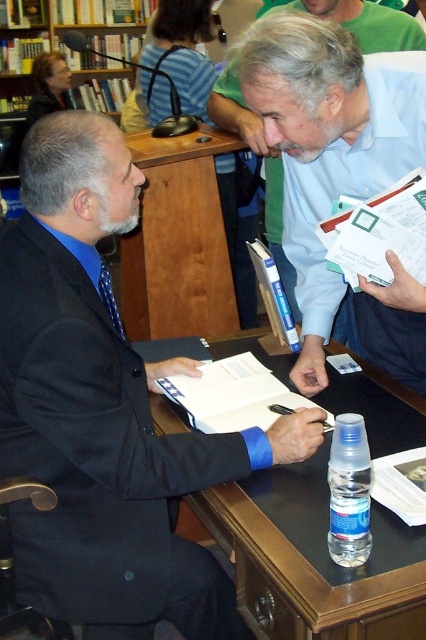
You are a delivery person who needs to place a small package on the desk without disturbing the black matte suit at center or the white paper at center. The package is 10 inches long. Can you fit it between them?

The distance between the black matte suit at center and the white paper at center is 8.98 inches. Since the package is 10 inches long, it cannot fit in the space between them.

You are a customer in the bookstore who needs to place an order for a book. The brown wood table at center is where you need to place your order. If you are standing 6.20 feet away from the table, can you reach the table without moving closer?

The distance between you and the brown wood table at center is 6.20 feet. Since you are 6.20 feet away from the table, you cannot reach it without moving closer because the typical human arm length is about 2.5 to 3 feet, which is significantly shorter than the distance provided.

You are an office assistant who needs to determine if the white paper at upper center can be placed under the black wood table at center. Based on their thickness, can it fit underneath?

The white paper at upper center is thinner than the black wood table at center, so it can fit underneath.